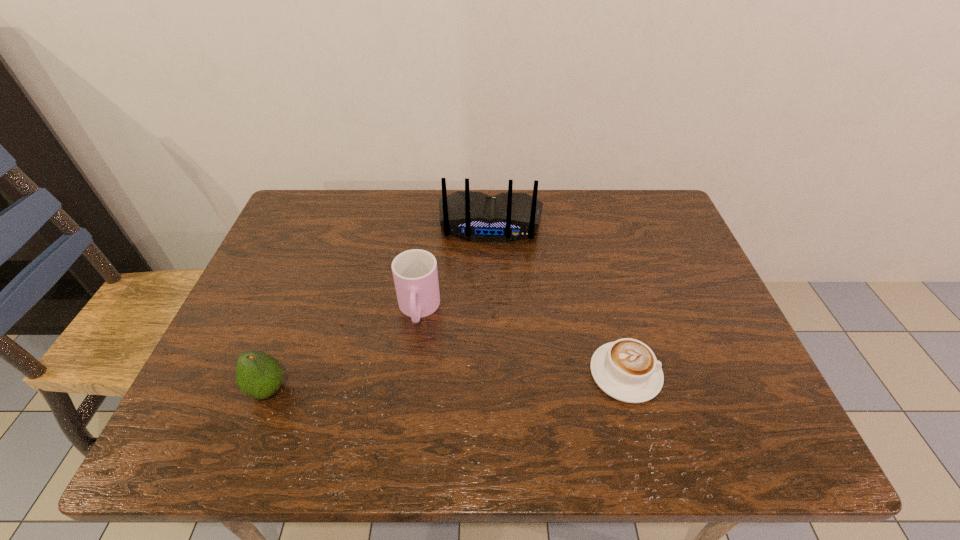
Where is `unoccupied area between the router and the shortest object`? The width and height of the screenshot is (960, 540). unoccupied area between the router and the shortest object is located at coordinates pos(558,298).

Locate an element on the screen. Image resolution: width=960 pixels, height=540 pixels. unoccupied position between the shortest object and the leftmost object is located at coordinates (446, 381).

Find the location of a particular element. This screenshot has height=540, width=960. empty space between the third nearest object and the router is located at coordinates (455, 267).

What are the coordinates of `free space between the cappuccino and the leftmost object` in the screenshot? It's located at (446, 381).

You are a GUI agent. You are given a task and a screenshot of the screen. Output one action in this format:
    pyautogui.click(x=<x>, y=<y>)
    Task: Click on the free spot between the shortest object and the cup
    The height and width of the screenshot is (540, 960).
    Given the screenshot: What is the action you would take?
    pyautogui.click(x=522, y=342)

Identify the location of vacant space that is in between the avocado and the tallest object. The height and width of the screenshot is (540, 960). (379, 307).

Locate an element on the screen. The width and height of the screenshot is (960, 540). object that is the nearest to the cappuccino is located at coordinates (476, 216).

What are the coordinates of `the third closest object to the shortest object` in the screenshot? It's located at (258, 375).

The height and width of the screenshot is (540, 960). What are the coordinates of `vacant point that satisfies the following two spatial constraints: 1. on the front side of the shortest object; 2. with the handle on the right side of the farthest object` in the screenshot? It's located at (495, 373).

Identify the location of free space that satisfies the following two spatial constraints: 1. on the back side of the avocado; 2. with the handle on the right side of the rightmost object. The image size is (960, 540). (275, 373).